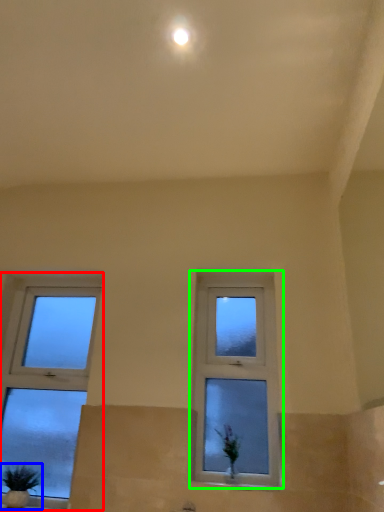
Question: Which object is the farthest from window (highlighted by a red box)? Choose among these: houseplant (highlighted by a blue box) or window (highlighted by a green box).

Choices:
 (A) houseplant
 (B) window

Answer: (B)